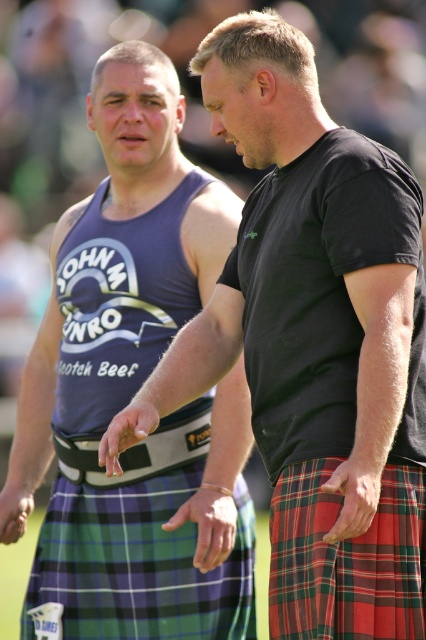
Question: Is green plaid kilt at center smaller than red plaid kilt at center?

Choices:
 (A) yes
 (B) no

Answer: (B)

Question: From the image, what is the correct spatial relationship of green plaid kilt at center in relation to red plaid kilt at center?

Choices:
 (A) left
 (B) right

Answer: (A)

Question: Which object is farther from the camera taking this photo?

Choices:
 (A) green plaid kilt at center
 (B) red plaid kilt at center

Answer: (A)

Question: Which point is closer to the camera?

Choices:
 (A) (340, 592)
 (B) (210, 579)

Answer: (A)

Question: Can you confirm if green plaid kilt at center is positioned to the left of red plaid kilt at center?

Choices:
 (A) no
 (B) yes

Answer: (B)

Question: Estimate the real-world distances between objects in this image. Which object is closer to the matte black tank top at left?

Choices:
 (A) red plaid kilt at center
 (B) green plaid kilt at center

Answer: (B)